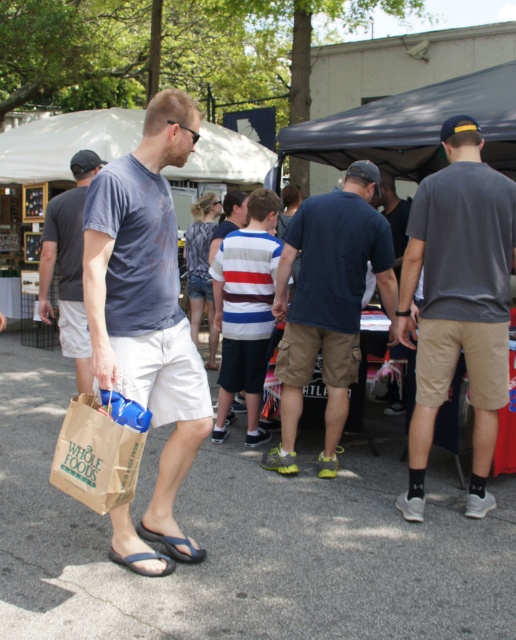
Who is lower down, gray asphalt pavement at center or dark blue t-shirt at center?

Positioned lower is gray asphalt pavement at center.

Which is more to the left, gray asphalt pavement at center or dark blue t-shirt at center?

Positioned to the left is gray asphalt pavement at center.

Which is in front, point (341, 547) or point (309, 358)?

Positioned in front is point (341, 547).

You are a GUI agent. You are given a task and a screenshot of the screen. Output one action in this format:
    pyautogui.click(x=<x>, y=<y>)
    Task: Click on the gray asphalt pavement at center
    This screenshot has height=640, width=516.
    Given the screenshot: What is the action you would take?
    pyautogui.click(x=247, y=540)

Who is higher up, matte blue t-shirt at left or matte gray t-shirt at center?

matte gray t-shirt at center is above.

Between point (121, 320) and point (59, 275), which one is positioned behind?

The point (59, 275) is behind.

Find the location of a particular element. The height and width of the screenshot is (640, 516). matte blue t-shirt at left is located at coordinates (147, 294).

Which is above, gray asphalt pavement at center or striped cotton shirt at center?

striped cotton shirt at center

Where is `gray asphalt pavement at center`? gray asphalt pavement at center is located at coordinates (247, 540).

You are a GUI agent. You are given a task and a screenshot of the screen. Output one action in this format:
    pyautogui.click(x=<x>, y=<y>)
    Task: Click on the gray asphalt pavement at center
    
    Given the screenshot: What is the action you would take?
    pyautogui.click(x=247, y=540)